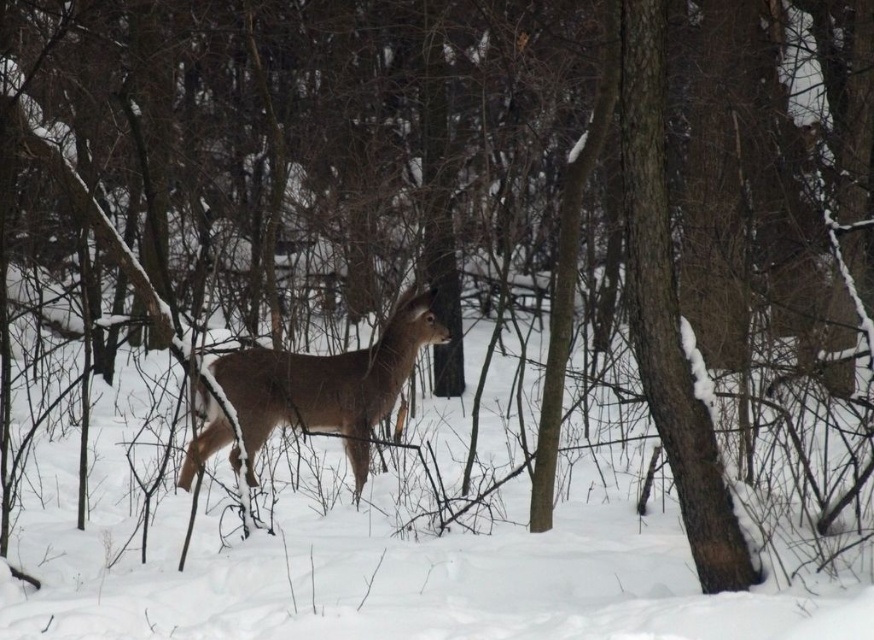
Question: Which point is closer to the camera?

Choices:
 (A) white fluffy snow at center
 (B) brown matte deer at center

Answer: (A)

Question: In this image, where is white fluffy snow at center located relative to brown matte deer at center?

Choices:
 (A) left
 (B) right

Answer: (B)

Question: Is white fluffy snow at center below brown matte deer at center?

Choices:
 (A) yes
 (B) no

Answer: (A)

Question: Does white fluffy snow at center appear on the right side of brown matte deer at center?

Choices:
 (A) yes
 (B) no

Answer: (A)

Question: Which of the following is the closest to the observer?

Choices:
 (A) (574, 589)
 (B) (274, 356)

Answer: (A)